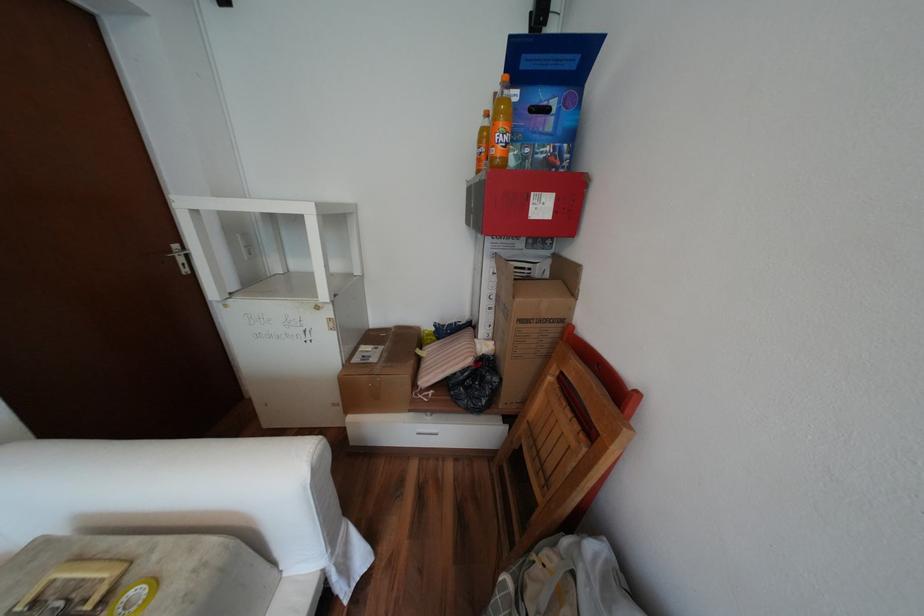
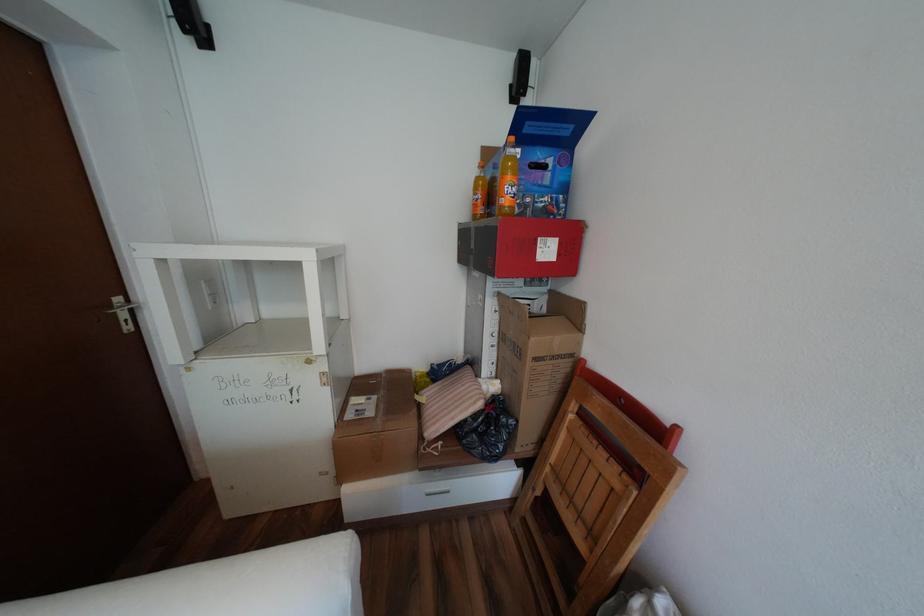
Locate, in the second image, the point that corresponds to point (488, 160) in the first image.

(484, 206)